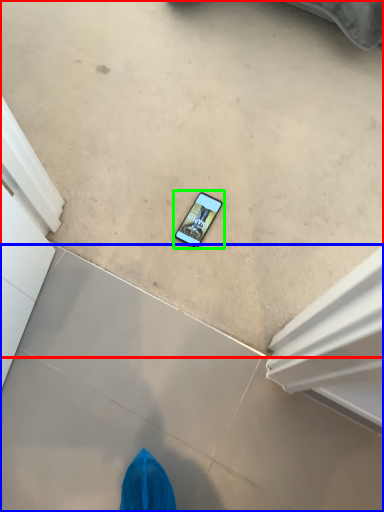
Question: Which object is the closest to the concrete (highlighted by a red box)? Choose among these: concrete (highlighted by a blue box) or mobile phone (highlighted by a green box).

Choices:
 (A) concrete
 (B) mobile phone

Answer: (B)